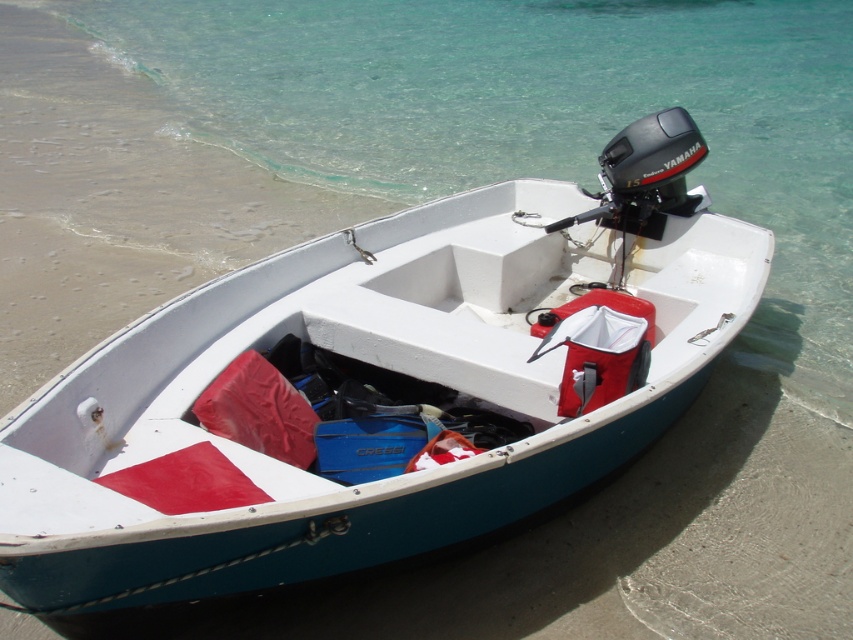
You are standing on the sandy beach and looking at the motorboat. There are two points marked on the boat. Which point is closer to you, point at coordinate [131,388] or point at coordinate [247,44]?

Point at coordinate [131,388] is closer to you than point at coordinate [247,44].

You are a lifeguard on duty and notice the white matte boat at center and the clear water at lower center. From your vantage point, which object is positioned higher in the image?

The clear water at lower center is positioned higher than the white matte boat at center because the white matte boat at center is located below clear water at lower center.